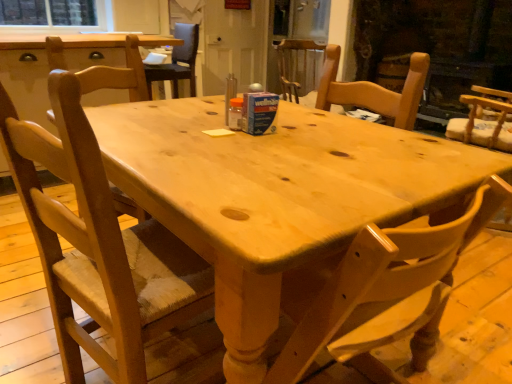
What do you see at coordinates (484, 121) in the screenshot? I see `light brown wood chair at right, arranged as the 1th chair when viewed from the right` at bounding box center [484, 121].

Measure the distance between clear glass window screen at upper left and camera.

A distance of 3.95 meters exists between clear glass window screen at upper left and camera.

The height and width of the screenshot is (384, 512). In order to click on transparent glass screen door at upper center, which ranks as the 1th screen door in right-to-left order in this screenshot , I will do `click(295, 30)`.

Describe the element at coordinates (387, 292) in the screenshot. The height and width of the screenshot is (384, 512). I see `natural wood chair at center, the 3th chair when ordered from right to left` at that location.

In order to click on dark brick fireplace at right in this screenshot , I will do `click(437, 45)`.

You are a GUI agent. You are given a task and a screenshot of the screen. Output one action in this format:
    pyautogui.click(x=<x>, y=<y>)
    Task: Click on the wooden chair at center, the 5th chair in the right-to-left sequence
    The width and height of the screenshot is (512, 384).
    Given the screenshot: What is the action you would take?
    pyautogui.click(x=177, y=61)

Locate an element on the screen. natural wood table at center is located at coordinates (279, 199).

Based on the photo, considering the sizes of objects light wood chair at center, acting as the 4th chair starting from the left, and natural wood chair at center, which appears as the 5th chair when viewed from the back, in the image provided, who is shorter, light wood chair at center, acting as the 4th chair starting from the left, or natural wood chair at center, which appears as the 5th chair when viewed from the back,?

light wood chair at center, acting as the 4th chair starting from the left.

From the image's perspective, relative to natural wood chair at center, acting as the third chair starting from the left, is light wood chair at center, which is the second chair from right to left, above or below?

light wood chair at center, which is the second chair from right to left, is situated higher than natural wood chair at center, acting as the third chair starting from the left, in the image.

Which object is closer to the camera, light wood chair at center, acting as the 4th chair starting from the left, or natural wood chair at center, which is counted as the 1th chair, starting from the front?

natural wood chair at center, which is counted as the 1th chair, starting from the front, is in front.

Locate an element on the screen. round table located underneath the white glossy door at upper center, which ranks as the 1th screen door in left-to-right order (from a real-world perspective) is located at coordinates (279, 199).

Considering the sizes of white glossy door at upper center, positioned as the second screen door in right-to-left order, and natural wood table at center in the image, is white glossy door at upper center, positioned as the second screen door in right-to-left order, wider or thinner than natural wood table at center?

white glossy door at upper center, positioned as the second screen door in right-to-left order, is thinner than natural wood table at center.

Does white glossy door at upper center, which ranks as the 1th screen door in left-to-right order, turn towards natural wood table at center?

No, white glossy door at upper center, which ranks as the 1th screen door in left-to-right order, is not oriented towards natural wood table at center.

Considering the positions of points (464, 141) and (370, 37), is point (464, 141) closer to camera compared to point (370, 37)?

Yes.

From the picture: From the image's perspective, which one is positioned lower, light brown wood chair at right, the third chair in the front-to-back sequence, or dark brick fireplace at right?

light brown wood chair at right, the third chair in the front-to-back sequence.

Is light brown wood chair at right, marked as the 5th chair in a left-to-right arrangement, far away from dark brick fireplace at right?

That's right, there is a large distance between light brown wood chair at right, marked as the 5th chair in a left-to-right arrangement, and dark brick fireplace at right.

Can you confirm if natural wood chair at left, the 2th chair in the left-to-right sequence, is positioned to the right of white glossy door at upper center, positioned as the second screen door in right-to-left order?

No, natural wood chair at left, the 2th chair in the left-to-right sequence, is not to the right of white glossy door at upper center, positioned as the second screen door in right-to-left order.

Is natural wood chair at left, the 2th chair in the left-to-right sequence, spatially inside white glossy door at upper center, positioned as the second screen door in right-to-left order, or outside of it?

natural wood chair at left, the 2th chair in the left-to-right sequence, exists outside the volume of white glossy door at upper center, positioned as the second screen door in right-to-left order.

Does natural wood chair at left, the 2th chair in the left-to-right sequence, have a smaller size compared to white glossy door at upper center, positioned as the second screen door in right-to-left order?

No.

Can you tell me how much natural wood chair at left, the 2th chair in the left-to-right sequence, and white glossy door at upper center, which ranks as the 1th screen door in left-to-right order, differ in facing direction?

The angular difference between natural wood chair at left, the 2th chair in the left-to-right sequence, and white glossy door at upper center, which ranks as the 1th screen door in left-to-right order, is 101 degrees.

Considering the positions of objects natural wood chair at center, which appears as the 5th chair when viewed from the back, and light wood chair at center, acting as the 4th chair starting from the left, in the image provided, who is behind, natural wood chair at center, which appears as the 5th chair when viewed from the back, or light wood chair at center, acting as the 4th chair starting from the left,?

light wood chair at center, acting as the 4th chair starting from the left, is further away from the camera.

How many degrees apart are the facing directions of natural wood chair at center, which appears as the 5th chair when viewed from the back, and light wood chair at center, acting as the 4th chair starting from the left?

They differ by 170 degrees in their facing directions.

Locate an element on the screen. This screenshot has height=384, width=512. the 4th chair in front when counting from the light wood chair at center, acting as the fifth chair starting from the front is located at coordinates (387, 292).

Based on their sizes in the image, would you say natural wood chair at center, which appears as the 5th chair when viewed from the back, is bigger or smaller than light wood chair at center, acting as the fifth chair starting from the front?

Clearly, natural wood chair at center, which appears as the 5th chair when viewed from the back, is smaller in size than light wood chair at center, acting as the fifth chair starting from the front.

Can you confirm if clear glass window screen at upper left is wider than transparent glass screen door at upper center, which ranks as the 1th screen door in right-to-left order?

In fact, clear glass window screen at upper left might be narrower than transparent glass screen door at upper center, which ranks as the 1th screen door in right-to-left order.

Considering the relative sizes of clear glass window screen at upper left and transparent glass screen door at upper center, which ranks as the 1th screen door in right-to-left order, in the image provided, is clear glass window screen at upper left smaller than transparent glass screen door at upper center, which ranks as the 1th screen door in right-to-left order,?

Indeed, clear glass window screen at upper left has a smaller size compared to transparent glass screen door at upper center, which ranks as the 1th screen door in right-to-left order.

Which object is further away from the camera taking this photo, clear glass window screen at upper left or transparent glass screen door at upper center, which is the second screen door in left-to-right order?

transparent glass screen door at upper center, which is the second screen door in left-to-right order, is more distant.

What's the angular difference between clear glass window screen at upper left and transparent glass screen door at upper center, which ranks as the 1th screen door in right-to-left order,'s facing directions?

clear glass window screen at upper left and transparent glass screen door at upper center, which ranks as the 1th screen door in right-to-left order, are facing 89.9 degrees away from each other.

From the image's perspective, is dark brick fireplace at right above or below light wood chair at center, acting as the 4th chair starting from the left?

Based on their image positions, dark brick fireplace at right is located above light wood chair at center, acting as the 4th chair starting from the left.

Between point (473, 31) and point (292, 65), which one is positioned in front?

The point (473, 31) is closer to the camera.

The height and width of the screenshot is (384, 512). I want to click on fireplace that appears in front of the light wood chair at center, which is the first chair from back to front, so click(437, 45).

There is a natural wood chair at center, the 3th chair when ordered from right to left. Find the location of `the 4th chair above it (from the image's perspective)`. the 4th chair above it (from the image's perspective) is located at coordinates (298, 67).

Which screen door is the 2nd one when counting from the back of the natural wood table at center? Please provide its 2D coordinates.

[(234, 45)]

Which object lies further to the anchor point light wood chair at center, which is the first chair from back to front, wooden chair at center, the 5th chair in the right-to-left sequence, or white glossy door at upper center, positioned as the second screen door in right-to-left order?

Based on the image, white glossy door at upper center, positioned as the second screen door in right-to-left order, appears to be further to light wood chair at center, which is the first chair from back to front.

Which object lies further to the anchor point dark brick fireplace at right, clear glass window screen at upper left or natural wood chair at left, marked as the fourth chair in a right-to-left arrangement?

Based on the image, natural wood chair at left, marked as the fourth chair in a right-to-left arrangement, appears to be further to dark brick fireplace at right.

Estimate the real-world distances between objects in this image. Which object is further from natural wood chair at left, the second chair viewed from the front, transparent glass screen door at upper center, which is the second screen door in left-to-right order, or natural wood table at center?

transparent glass screen door at upper center, which is the second screen door in left-to-right order, lies further to natural wood chair at left, the second chair viewed from the front, than the other object.

Estimate the real-world distances between objects in this image. Which object is closer to wooden chair at center, the 5th chair in the right-to-left sequence, natural wood table at center or dark brick fireplace at right?

dark brick fireplace at right.

Considering their positions, is clear glass window screen at upper left positioned further to natural wood chair at left, marked as the fourth chair in a right-to-left arrangement, than transparent glass screen door at upper center, which is the second screen door in left-to-right order?

Based on the image, clear glass window screen at upper left appears to be further to natural wood chair at left, marked as the fourth chair in a right-to-left arrangement.

Based on the photo, when comparing their distances from natural wood chair at center, which appears as the 5th chair when viewed from the back, does white glossy door at upper center, positioned as the second screen door in right-to-left order, or light brown wood chair at right, marked as the 5th chair in a left-to-right arrangement, seem further?

Among the two, white glossy door at upper center, positioned as the second screen door in right-to-left order, is located further to natural wood chair at center, which appears as the 5th chair when viewed from the back.

Based on their spatial positions, is natural wood chair at center, acting as the third chair starting from the left, or light wood chair at center, which is the second chair from right to left, closer to white glossy door at upper center, which ranks as the 1th screen door in left-to-right order?

light wood chair at center, which is the second chair from right to left, lies closer to white glossy door at upper center, which ranks as the 1th screen door in left-to-right order, than the other object.

Based on their spatial positions, is white glossy door at upper center, positioned as the second screen door in right-to-left order, or natural wood chair at left, marked as the fourth chair in a right-to-left arrangement, further from wooden chair at center, the 5th chair in the right-to-left sequence?

The object further to wooden chair at center, the 5th chair in the right-to-left sequence, is natural wood chair at left, marked as the fourth chair in a right-to-left arrangement.

Locate an element on the screen. chair situated between light wood chair at center, which is the second chair from right to left, and dark brick fireplace at right from left to right is located at coordinates (484, 121).

This screenshot has width=512, height=384. Find the location of `fireplace between natural wood table at center and white glossy door at upper center, positioned as the second screen door in right-to-left order, in the front-back direction`. fireplace between natural wood table at center and white glossy door at upper center, positioned as the second screen door in right-to-left order, in the front-back direction is located at coordinates (437, 45).

This screenshot has height=384, width=512. In order to click on fireplace located between natural wood chair at left, the 2th chair in the left-to-right sequence, and light wood chair at center, which is the first chair from back to front, in the depth direction in this screenshot , I will do `click(437, 45)`.

At what (x,y) coordinates should I click in order to perform the action: click on window screen between natural wood chair at left, marked as the fourth chair in a right-to-left arrangement, and transparent glass screen door at upper center, which ranks as the 1th screen door in right-to-left order, from front to back. Please return your answer as a coordinate pair (x, y). Looking at the image, I should click on (53, 14).